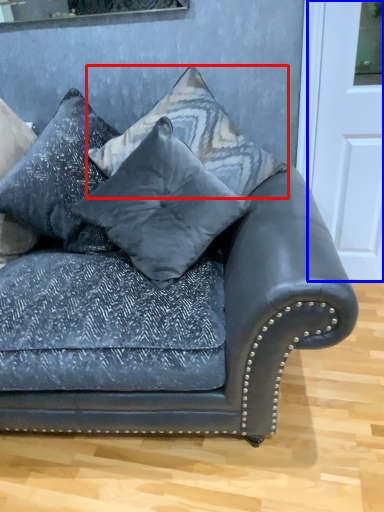
Question: Which of the following is the closest to the observer, pillow (highlighted by a red box) or door (highlighted by a blue box)?

Choices:
 (A) pillow
 (B) door

Answer: (A)